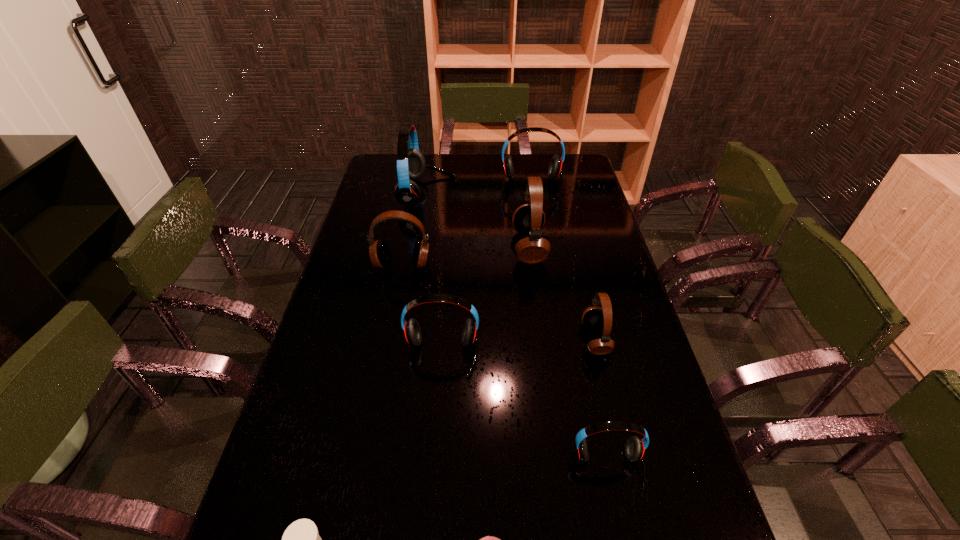
The width and height of the screenshot is (960, 540). Identify the location of object positioned at the far left corner. (411, 164).

Where is `object located at the far right corner`? The width and height of the screenshot is (960, 540). object located at the far right corner is located at coordinates tap(555, 169).

Locate an element on the screen. The height and width of the screenshot is (540, 960). free point at the far edge is located at coordinates (x=476, y=167).

Where is `free location at the left edge of the desktop`? free location at the left edge of the desktop is located at coordinates (359, 361).

Where is `free space at the right edge of the desktop`? The image size is (960, 540). free space at the right edge of the desktop is located at coordinates (587, 205).

Find the location of a particular element. The width and height of the screenshot is (960, 540). free region at the far right corner is located at coordinates (569, 173).

At what (x,y) coordinates should I click in order to perform the action: click on empty space that is in between the second smallest black headset and the nearest black headset. Please return your answer as a coordinate pair (x, y). Looking at the image, I should click on (499, 302).

The width and height of the screenshot is (960, 540). In order to click on free area in between the biggest black headset and the seventh farthest object in this screenshot , I will do `click(569, 358)`.

I want to click on blank region between the smallest black headset and the second nearest red headset, so click(518, 347).

Where is `unoccupied position between the smallest black headset and the third nearest object`? Image resolution: width=960 pixels, height=540 pixels. unoccupied position between the smallest black headset and the third nearest object is located at coordinates pyautogui.click(x=602, y=404).